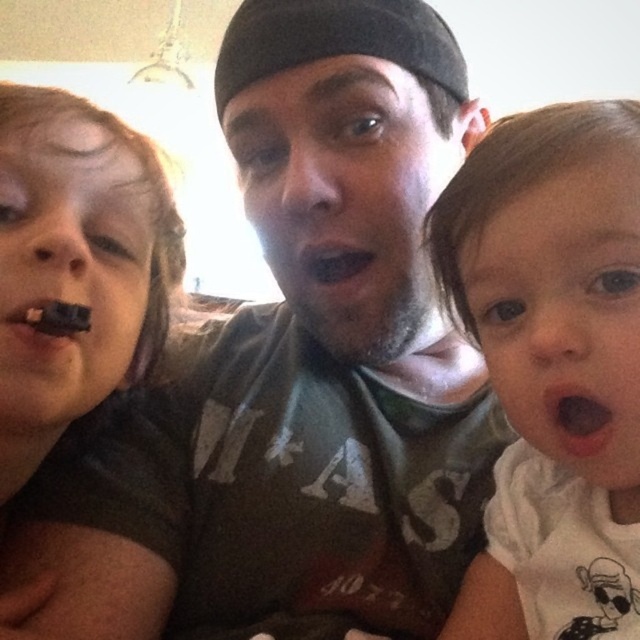
You are a photographer who wants to ensure that both the white soft baby at right and the black matte mouth at center are clearly visible in your photo. Based on their positions, which one should you focus on first to ensure proper focus?

Since the white soft baby at right is to the right of the black matte mouth at center, you should focus on the black matte mouth at center first as it is closer to the center of the frame, ensuring both are in focus by using a smaller aperture or adjusting your focus point accordingly.

You are a photographer trying to capture a candid shot of the chocolate matte at left and the black matte mouth at center. Based on their positions, which object is closer to the bottom edge of the frame?

The chocolate matte at left is located below the black matte mouth at center, so it is closer to the bottom edge of the frame.

You are a photographer trying to capture a closeup shot of the chocolate matte at left and the black matte mouth at center. Which object should you zoom in on to ensure it fills the frame more without moving the camera?

The black matte mouth at center should be zoomed in on because it occupies more space than the chocolate matte at left, so it will fill the frame more when zoomed in.